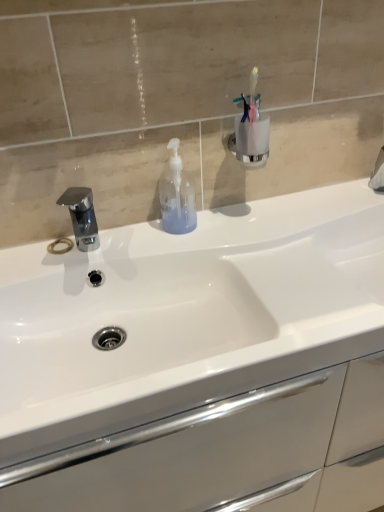
Question: From the image's perspective, is white glossy sink at center beneath translucent plastic soap dispenser at center?

Choices:
 (A) yes
 (B) no

Answer: (A)

Question: From the image's perspective, does white glossy sink at center appear higher than translucent plastic soap dispenser at center?

Choices:
 (A) no
 (B) yes

Answer: (A)

Question: Is white glossy sink at center to the left of translucent plastic soap dispenser at center from the viewer's perspective?

Choices:
 (A) no
 (B) yes

Answer: (A)

Question: Is the position of white glossy sink at center less distant than that of translucent plastic soap dispenser at center?

Choices:
 (A) no
 (B) yes

Answer: (B)

Question: From a real-world perspective, is white glossy sink at center on top of translucent plastic soap dispenser at center?

Choices:
 (A) no
 (B) yes

Answer: (A)

Question: Is chrome metallic faucet at left spatially inside translucent plastic soap dispenser at center, or outside of it?

Choices:
 (A) outside
 (B) inside

Answer: (A)

Question: Is point (94, 224) closer or farther from the camera than point (177, 174)?

Choices:
 (A) closer
 (B) farther

Answer: (B)

Question: From a real-world perspective, relative to translucent plastic soap dispenser at center, is chrome metallic faucet at left vertically above or below?

Choices:
 (A) below
 (B) above

Answer: (A)

Question: In terms of size, does chrome metallic faucet at left appear bigger or smaller than translucent plastic soap dispenser at center?

Choices:
 (A) big
 (B) small

Answer: (A)

Question: In terms of size, does translucent plastic soap dispenser at center appear bigger or smaller than chrome metallic faucet at left?

Choices:
 (A) big
 (B) small

Answer: (B)

Question: In terms of height, does translucent plastic soap dispenser at center look taller or shorter compared to chrome metallic faucet at left?

Choices:
 (A) short
 (B) tall

Answer: (B)

Question: From a real-world perspective, relative to chrome metallic faucet at left, is translucent plastic soap dispenser at center vertically above or below?

Choices:
 (A) above
 (B) below

Answer: (A)

Question: Considering the positions of translucent plastic soap dispenser at center and chrome metallic faucet at left in the image, is translucent plastic soap dispenser at center wider or thinner than chrome metallic faucet at left?

Choices:
 (A) wide
 (B) thin

Answer: (B)

Question: Considering the relative positions of translucent plastic soap dispenser at center and white glossy sink at center in the image provided, is translucent plastic soap dispenser at center to the left or to the right of white glossy sink at center?

Choices:
 (A) left
 (B) right

Answer: (A)

Question: From the image's perspective, relative to white glossy sink at center, is translucent plastic soap dispenser at center above or below?

Choices:
 (A) below
 (B) above

Answer: (B)